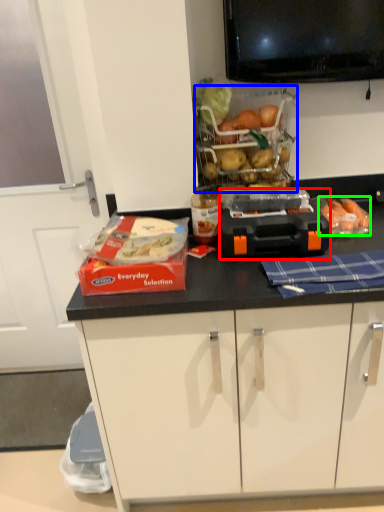
Question: Which is nearer to the appliance (highlighted by a red box)? basket (highlighted by a blue box) or food (highlighted by a green box).

Choices:
 (A) basket
 (B) food

Answer: (B)